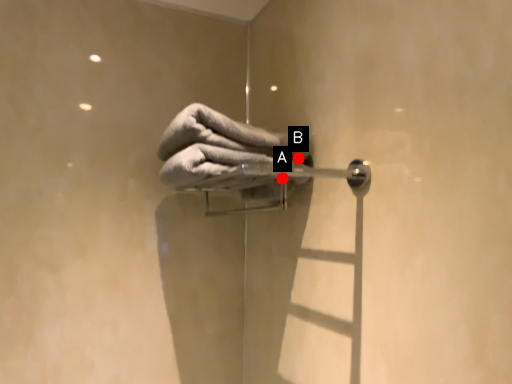
Question: Two points are circled on the image, labeled by A and B beside each circle. Which point appears farthest from the camera in this image?

Choices:
 (A) A is further
 (B) B is further

Answer: (B)